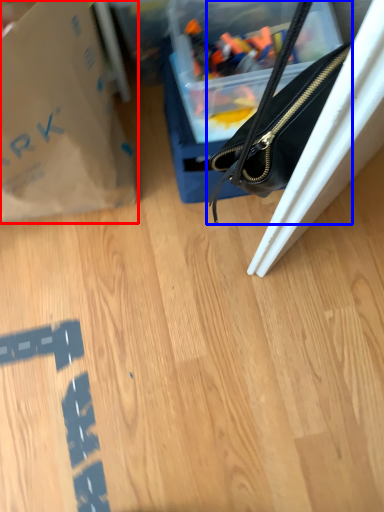
Question: Which of the following is the farthest to the observer, tote bag (highlighted by a red box) or handbag (highlighted by a blue box)?

Choices:
 (A) tote bag
 (B) handbag

Answer: (B)